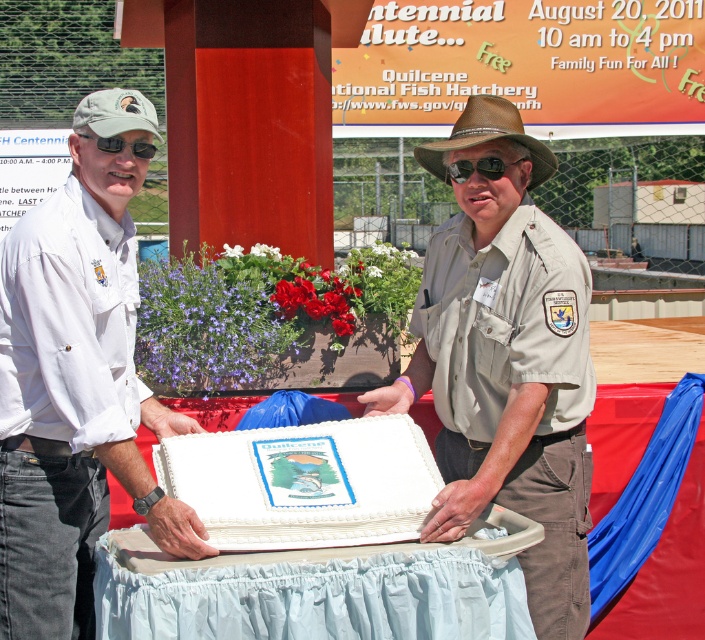
Which is more to the left, tan uniform at center or white frosted cake at center?

From the viewer's perspective, white frosted cake at center appears more on the left side.

What do you see at coordinates (505, 362) in the screenshot? This screenshot has width=705, height=640. I see `tan uniform at center` at bounding box center [505, 362].

You are a GUI agent. You are given a task and a screenshot of the screen. Output one action in this format:
    pyautogui.click(x=<x>, y=<y>)
    Task: Click on the tan uniform at center
    
    Given the screenshot: What is the action you would take?
    point(505,362)

Between white matte cake at center and tan uniform at center, which one has less height?

With less height is white matte cake at center.

Can you confirm if white matte cake at center is taller than tan uniform at center?

Incorrect, white matte cake at center's height is not larger of tan uniform at center's.

Is point (520, 257) less distant than point (482, 129)?

Yes, it is in front of point (482, 129).

Locate an element on the screen. The height and width of the screenshot is (640, 705). white matte cake at center is located at coordinates (508, 384).

Can you confirm if white matte cake at center is wider than black matte sunglasses at upper left?

Correct, the width of white matte cake at center exceeds that of black matte sunglasses at upper left.

Locate an element on the screen. This screenshot has width=705, height=640. white matte cake at center is located at coordinates (508, 384).

Is point (446, 384) positioned in front of point (116, 148)?

That is False.

Locate an element on the screen. This screenshot has width=705, height=640. white matte cake at center is located at coordinates (508, 384).